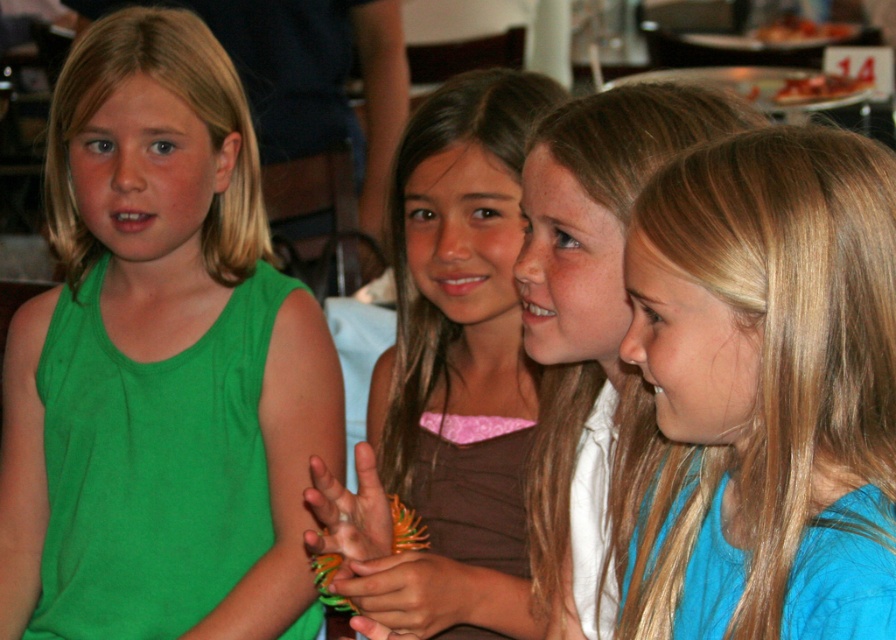
Between point (514, 77) and point (567, 506), which one is positioned in front?

Point (567, 506) is in front.

Can you confirm if brown matte shirt at center is positioned to the right of blue fabric shirt at center?

Incorrect, brown matte shirt at center is not on the right side of blue fabric shirt at center.

Who is more distant from viewer, (380, 566) or (543, 488)?

Point (543, 488)

Locate an element on the screen. The width and height of the screenshot is (896, 640). brown matte shirt at center is located at coordinates (452, 371).

Can you confirm if blue smooth shirt at right is bigger than smooth orange bracelet at center?

Indeed, blue smooth shirt at right has a larger size compared to smooth orange bracelet at center.

Which is in front, point (679, 401) or point (461, 609)?

Point (679, 401) is in front.

The width and height of the screenshot is (896, 640). What do you see at coordinates (767, 388) in the screenshot? I see `blue smooth shirt at right` at bounding box center [767, 388].

Find the location of a particular element. blue smooth shirt at right is located at coordinates (767, 388).

Is green fabric shirt at left wider than blue fabric shirt at center?

Yes, green fabric shirt at left is wider than blue fabric shirt at center.

Measure the distance between point (91,168) and camera.

The distance of point (91,168) from camera is 5.36 feet.

At what (x,y) coordinates should I click in order to perform the action: click on green fabric shirt at left. Please return your answer as a coordinate pair (x, y). Image resolution: width=896 pixels, height=640 pixels. Looking at the image, I should click on (160, 364).